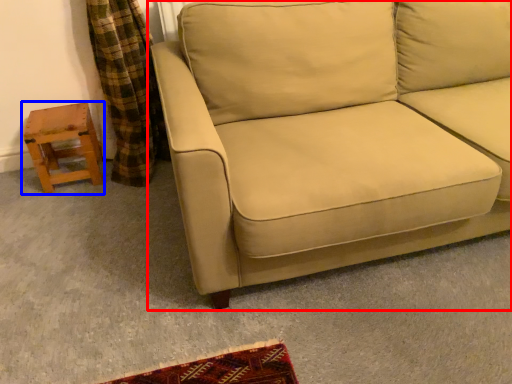
Question: Which object is further to the camera taking this photo, studio couch (highlighted by a red box) or stool (highlighted by a blue box)?

Choices:
 (A) studio couch
 (B) stool

Answer: (B)